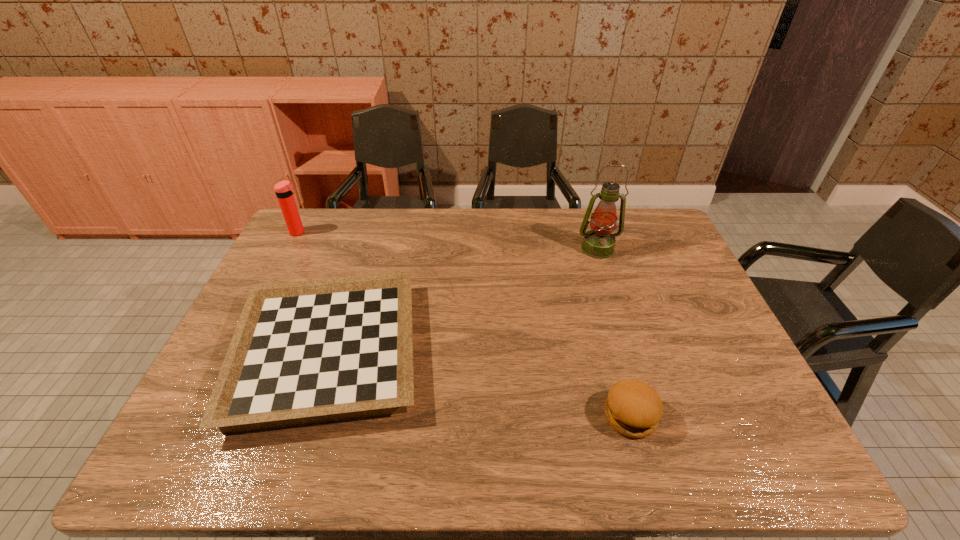
This screenshot has width=960, height=540. Find the location of `the third nearest object`. the third nearest object is located at coordinates (599, 242).

Find the location of a particular element. The height and width of the screenshot is (540, 960). the tallest object is located at coordinates (599, 242).

Identify the location of thermos bottle. Image resolution: width=960 pixels, height=540 pixels. (284, 190).

I want to click on the farthest object, so click(284, 190).

The width and height of the screenshot is (960, 540). What are the coordinates of `the second shortest object` in the screenshot? It's located at (632, 408).

Locate an element on the screen. checkerboard is located at coordinates (304, 352).

This screenshot has height=540, width=960. I want to click on free space located on the left of the third nearest object, so click(466, 248).

Image resolution: width=960 pixels, height=540 pixels. I want to click on vacant space located on the right of the third shortest object, so click(344, 232).

What are the coordinates of `vacant region located on the right of the hamburger` in the screenshot? It's located at (683, 416).

Locate an element on the screen. The width and height of the screenshot is (960, 540). vacant space located on the back of the shortest object is located at coordinates (372, 216).